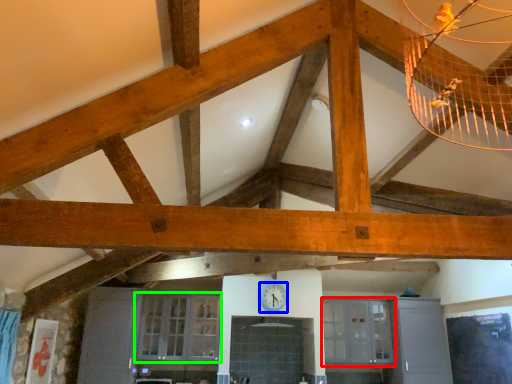
Question: Which object is the farthest from window (highlighted by a red box)? Choose among these: clock (highlighted by a blue box) or window (highlighted by a green box).

Choices:
 (A) clock
 (B) window

Answer: (B)